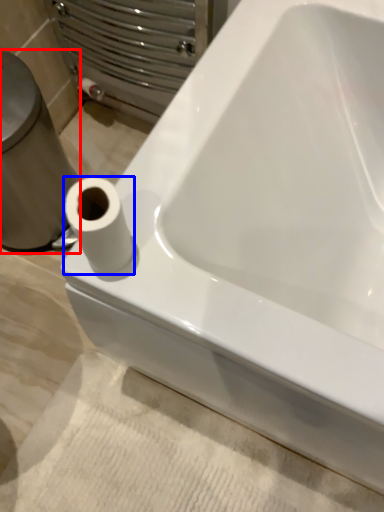
Question: Which of the following is the farthest to the observer, porcelain (highlighted by a red box) or toilet paper (highlighted by a blue box)?

Choices:
 (A) porcelain
 (B) toilet paper

Answer: (A)